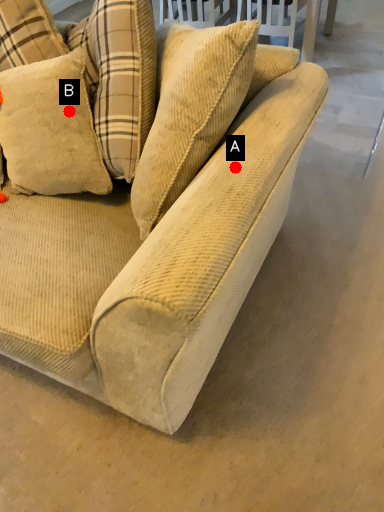
Question: Two points are circled on the image, labeled by A and B beside each circle. Which point is farther to the camera?

Choices:
 (A) A is further
 (B) B is further

Answer: (B)